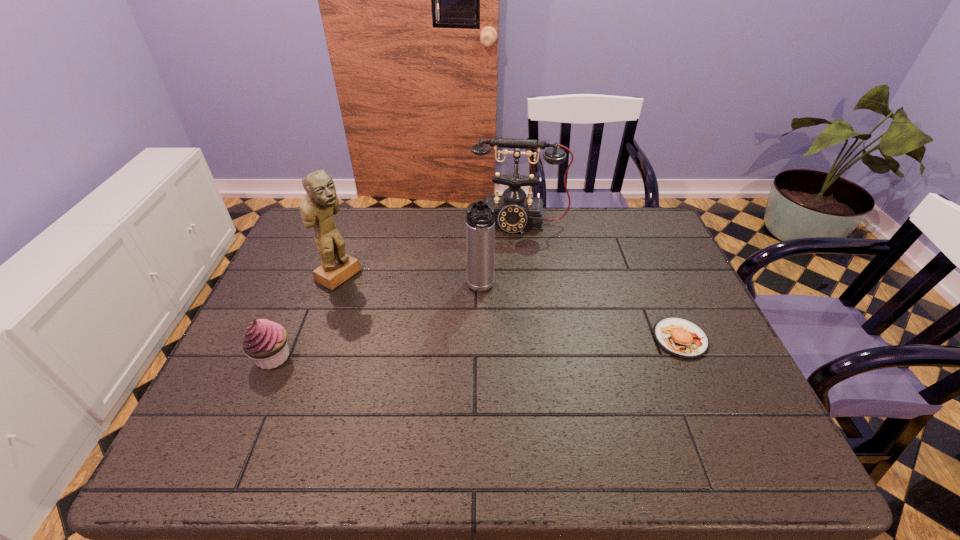
This screenshot has height=540, width=960. Identify the location of empty space between the thermos bottle and the figurine. (410, 282).

What are the coordinates of `free space between the fourth tallest object and the farthest object` in the screenshot? It's located at (396, 289).

At what (x,y) coordinates should I click in order to perform the action: click on vacant space that's between the telephone and the fourth tallest object. Please return your answer as a coordinate pair (x, y). This screenshot has width=960, height=540. Looking at the image, I should click on (396, 289).

Where is `vacant space in between the fourth tallest object and the shortest object`? The height and width of the screenshot is (540, 960). vacant space in between the fourth tallest object and the shortest object is located at coordinates (476, 348).

Identify the location of free space between the rightmost object and the farthest object. (600, 280).

Image resolution: width=960 pixels, height=540 pixels. In order to click on empty space that is in between the telephone and the figurine in this screenshot , I will do click(429, 249).

I want to click on object that stands as the third closest to the figurine, so click(514, 212).

In order to click on the second closest object to the figurine in this screenshot , I will do `click(480, 219)`.

The width and height of the screenshot is (960, 540). What are the coordinates of `free location that satisfies the following two spatial constraints: 1. on the back side of the fourth tallest object; 2. on the right side of the patty` in the screenshot? It's located at (281, 339).